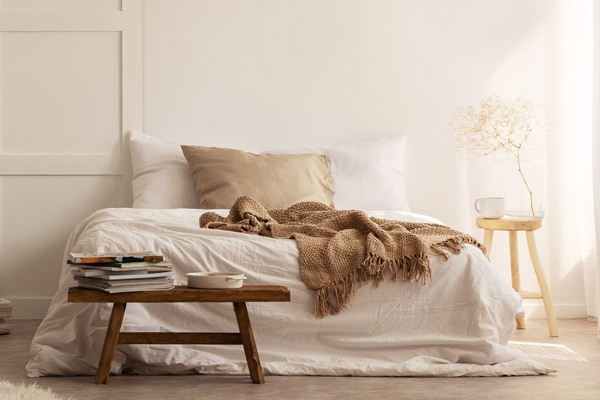
This screenshot has height=400, width=600. What are the coordinates of `stool` in the screenshot? It's located at (205, 295).